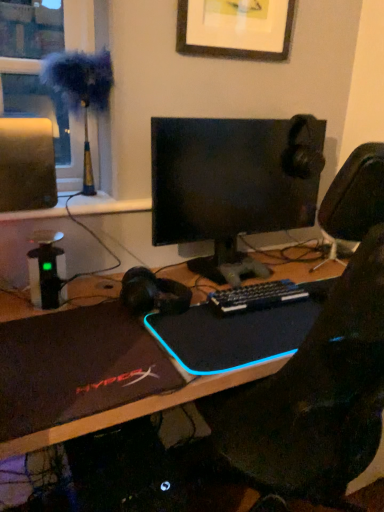
What are the coordinates of `vacant region to the right of black plastic keyboard at center` in the screenshot? It's located at (304, 304).